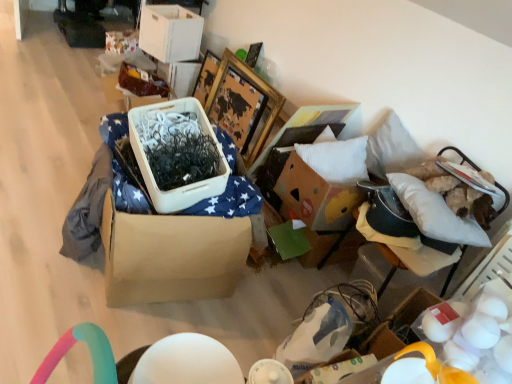
Question: Is wooden picture frame at upper center closer to camera compared to white fabric cushion at right?

Choices:
 (A) no
 (B) yes

Answer: (A)

Question: Is wooden picture frame at upper center bigger than white fabric cushion at right?

Choices:
 (A) no
 (B) yes

Answer: (B)

Question: Does wooden picture frame at upper center have a greater height compared to white fabric cushion at right?

Choices:
 (A) no
 (B) yes

Answer: (B)

Question: Is wooden picture frame at upper center oriented towards white fabric cushion at right?

Choices:
 (A) no
 (B) yes

Answer: (A)

Question: Is wooden picture frame at upper center looking in the opposite direction of white fabric cushion at right?

Choices:
 (A) no
 (B) yes

Answer: (A)

Question: Can you confirm if wooden picture frame at upper center is wider than white fabric cushion at right?

Choices:
 (A) yes
 (B) no

Answer: (B)

Question: Is the position of white fabric cushion at right more distant than that of white matte eggs at lower right?

Choices:
 (A) no
 (B) yes

Answer: (B)

Question: Is white fabric cushion at right bigger than white matte eggs at lower right?

Choices:
 (A) no
 (B) yes

Answer: (B)

Question: Is white fabric cushion at right oriented towards white matte eggs at lower right?

Choices:
 (A) no
 (B) yes

Answer: (A)

Question: Can you confirm if white fabric cushion at right is smaller than white matte eggs at lower right?

Choices:
 (A) no
 (B) yes

Answer: (A)

Question: Could white matte eggs at lower right be considered to be inside white fabric cushion at right?

Choices:
 (A) yes
 (B) no

Answer: (B)

Question: Can you confirm if white fabric cushion at right is taller than white matte eggs at lower right?

Choices:
 (A) no
 (B) yes

Answer: (A)

Question: Is brown cardboard box at center to the right of wooden picture frame at upper center from the viewer's perspective?

Choices:
 (A) no
 (B) yes

Answer: (A)